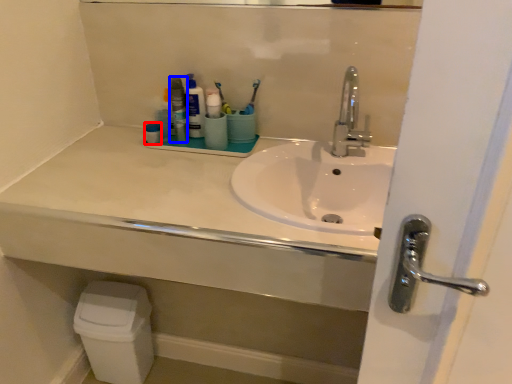
Question: Which object appears closest to the camera in this image, toiletry (highlighted by a red box) or mouthwash (highlighted by a blue box)?

Choices:
 (A) toiletry
 (B) mouthwash

Answer: (B)